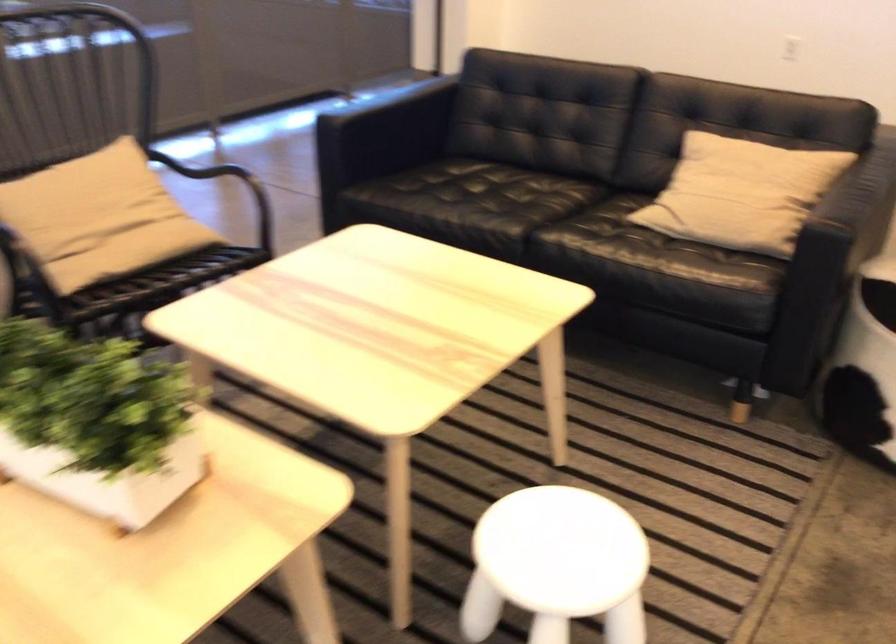
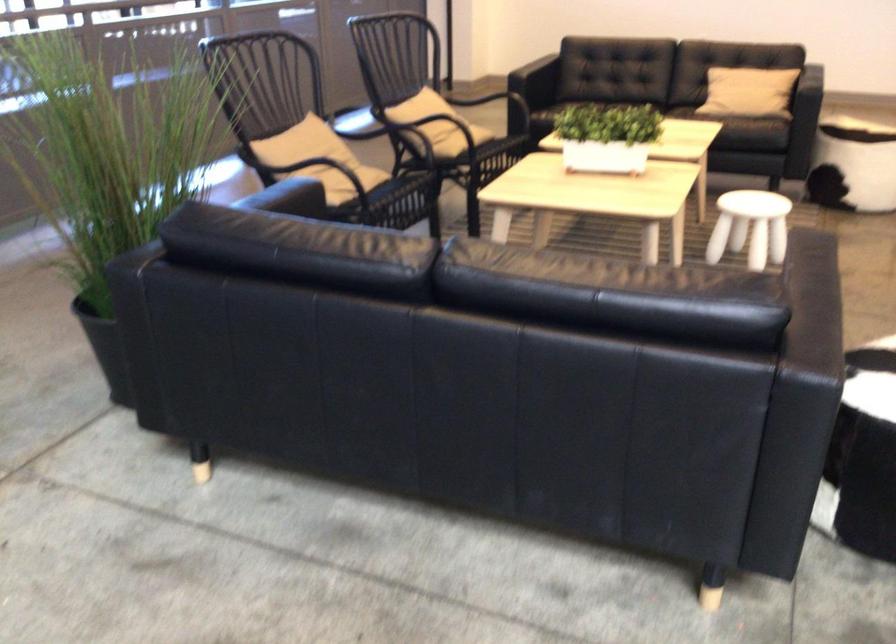
Find the pixel in the second image that matches (76,279) in the first image.

(462, 140)